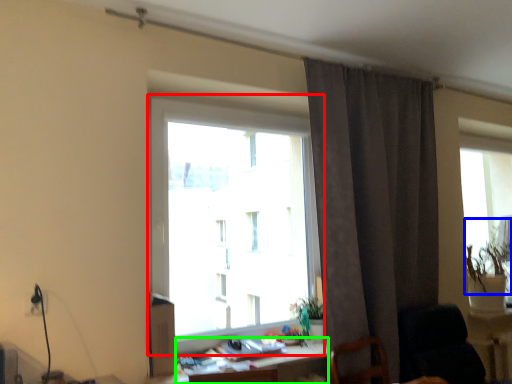
Question: Which object is positioned farthest from window (highlighted by a red box)? Select from plant (highlighted by a blue box) and table (highlighted by a green box).

Choices:
 (A) plant
 (B) table

Answer: (A)